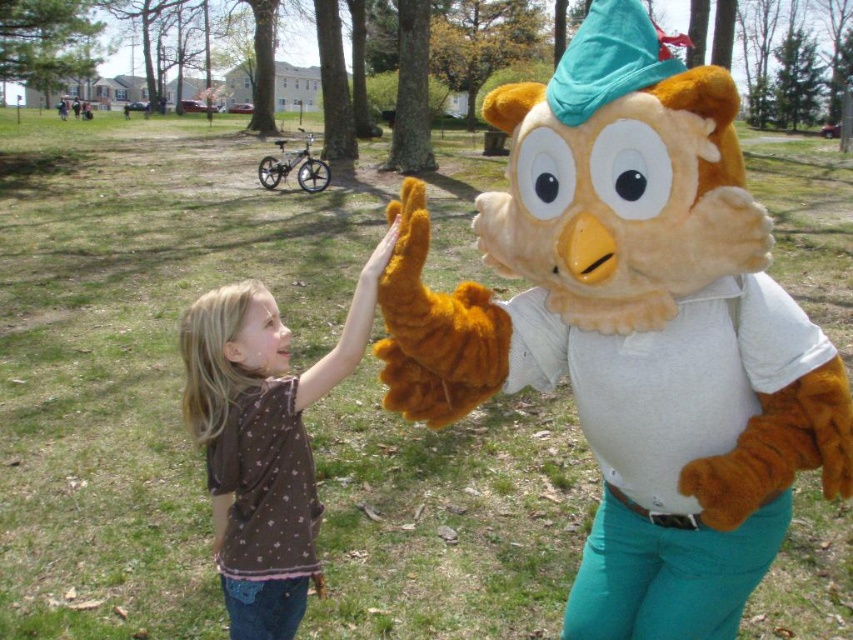
What is located at the coordinates point (633, 328) in the image?

At point (633, 328) lies fluffy brown owl at center.

You are a photographer trying to capture the perfect shot of the child and the mascot. You notice two points marked in the scene. The first point is at coordinates point (x=489, y=240) and the second is at point (x=247, y=504). Which point is closer to the camera?

Point (x=489, y=240) is in front of point (x=247, y=504), so it is closer to the camera.

You are a costume designer who needs to ensure the mascot costume fits properly. Given the scene, which object is bigger and needs more fabric? Please choose between the fluffy brown owl at center and the brown fabric shirt at center.

The fluffy brown owl at center is larger in size than the brown fabric shirt at center, so it requires more fabric.